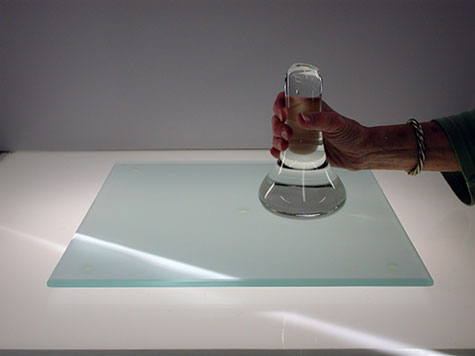
Find the location of a particular element. This screenshot has height=356, width=475. white table is located at coordinates (62, 206).